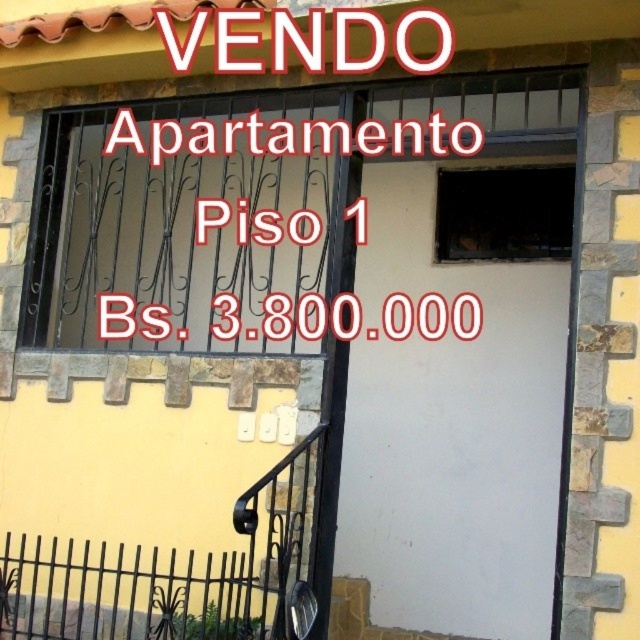
Which is more to the right, white matte door at center or white matte sign at upper center?

white matte door at center

Can you confirm if white matte door at center is smaller than white matte sign at upper center?

Incorrect, white matte door at center is not smaller in size than white matte sign at upper center.

Between point (452, 566) and point (294, 26), which one is positioned in front?

Point (294, 26) is more forward.

Identify the location of white matte door at center. This screenshot has height=640, width=640. (460, 401).